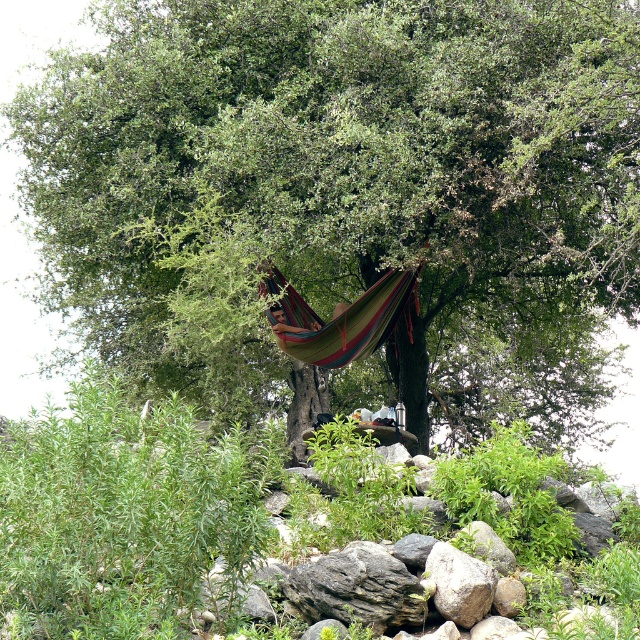
You are standing at point (349, 164) in this outdoor scene. What object is located exactly at your current position?

The green leafy tree at center is located exactly at point (349, 164).

Based on the photo, you are standing in the scene and want to place a small potted plant between the two points, point (355,330) and point (445,588). Which point should the plant be closer to so it is closer to the camera?

The plant should be placed closer to point (355,330) because it is further to the camera than point (445,588).